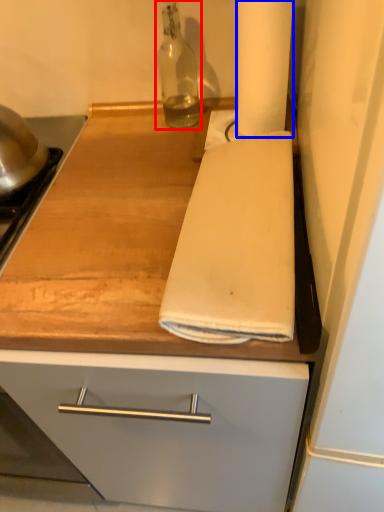
Question: Which object is further to the camera taking this photo, bottle (highlighted by a red box) or paper towel (highlighted by a blue box)?

Choices:
 (A) bottle
 (B) paper towel

Answer: (A)